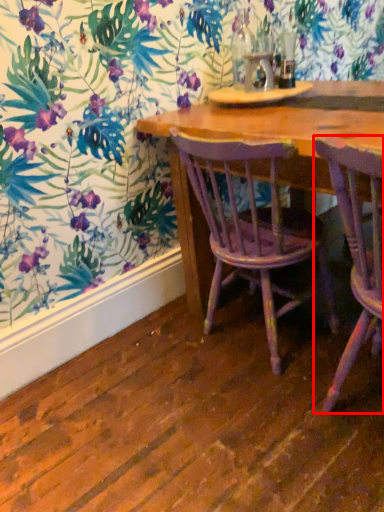
Question: Considering the relative positions of chair (annotated by the red box) and chair in the image provided, where is chair (annotated by the red box) located with respect to the staircase?

Choices:
 (A) right
 (B) left

Answer: (A)